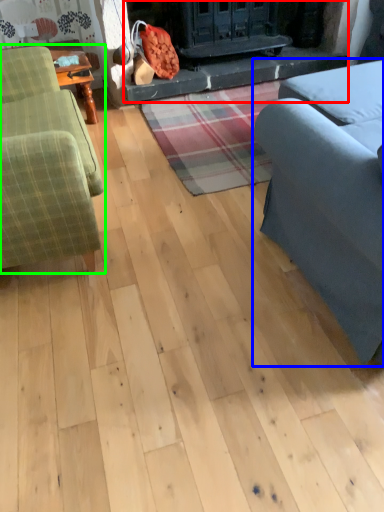
Question: Which is farther away from fireplace (highlighted by a red box)? studio couch (highlighted by a blue box) or studio couch (highlighted by a green box)?

Choices:
 (A) studio couch
 (B) studio couch

Answer: (A)